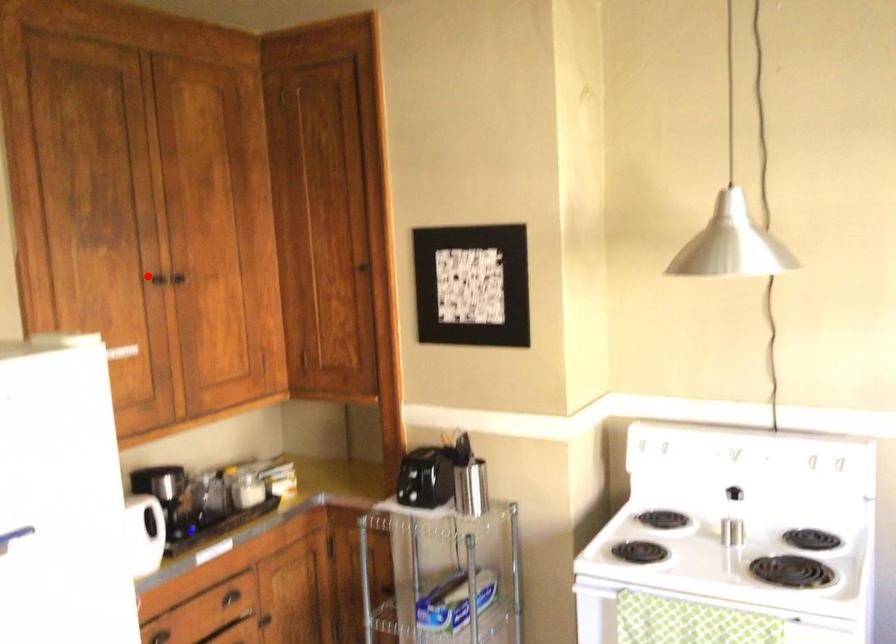
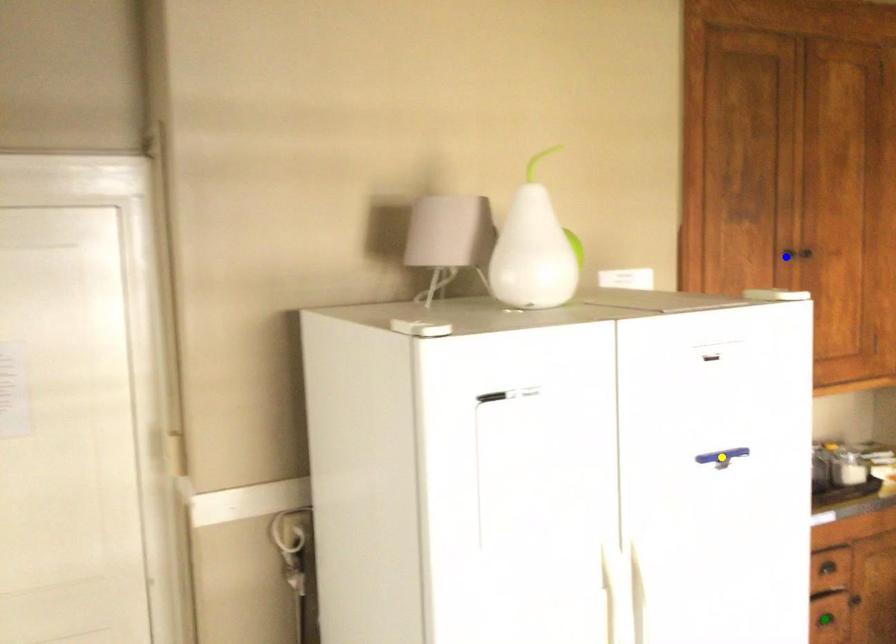
Question: I am providing you with two images of the same scene from different viewpoints. A red point is marked on the first image. You are given multiple points on the second image. Which point in image 2 is actually the same real-world point as the red point in image 1?

Choices:
 (A) blue point
 (B) yellow point
 (C) green point

Answer: (A)